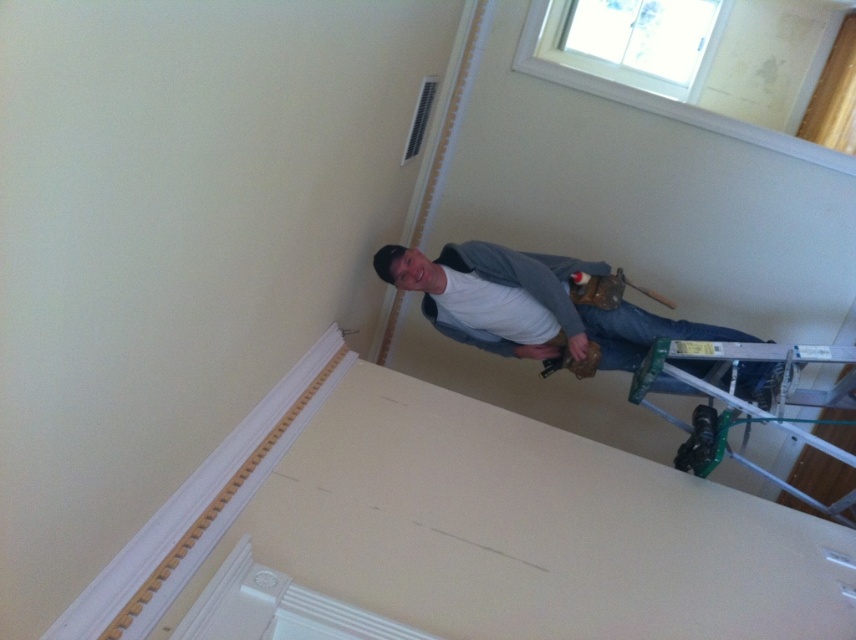
You are a painter working in this room. You need to move your silver metallic ladder at lower right closer to the gray fabric shirt at upper right to reach a high spot on the wall. How much distance do you need to move the ladder towards the shirt?

The gray fabric shirt at upper right is currently 13.63 inches away from the silver metallic ladder at lower right. To reach the shirt, you need to move the ladder closer by 13.63 inches.

You are a painter working in the room. You need to reach the gray fabric shirt at upper right and the silver metallic ladder at lower right. Which object is closer to you?

The gray fabric shirt at upper right is positioned over the silver metallic ladder at lower right, so the gray fabric shirt at upper right is closer to you.

You are a painter working in the room. You need to determine which object, the gray fabric shirt at upper right or the silver metallic ladder at lower right, has a greater width to decide which one to move first. Based on the scene, which one is wider?

The gray fabric shirt at upper right has a greater width than the silver metallic ladder at lower right according to the description.